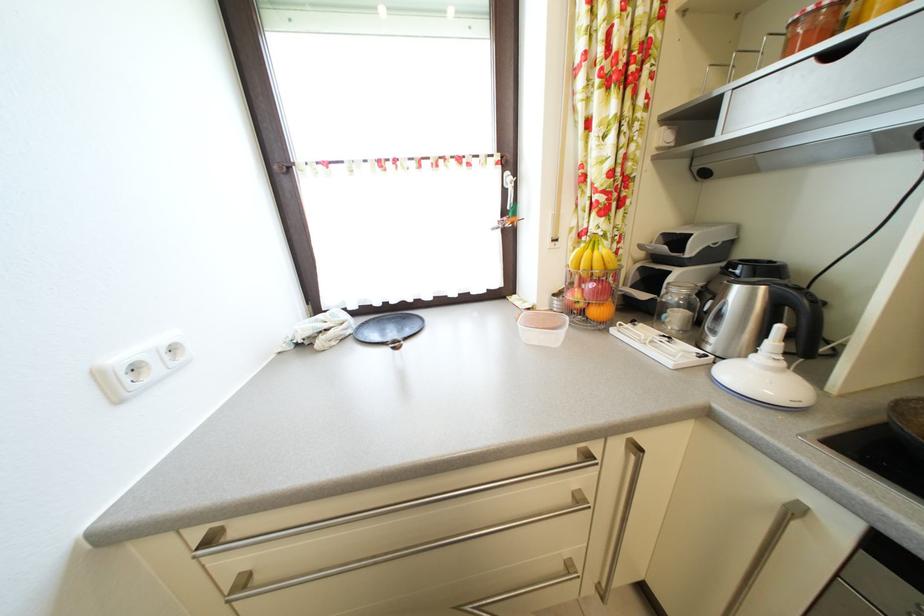
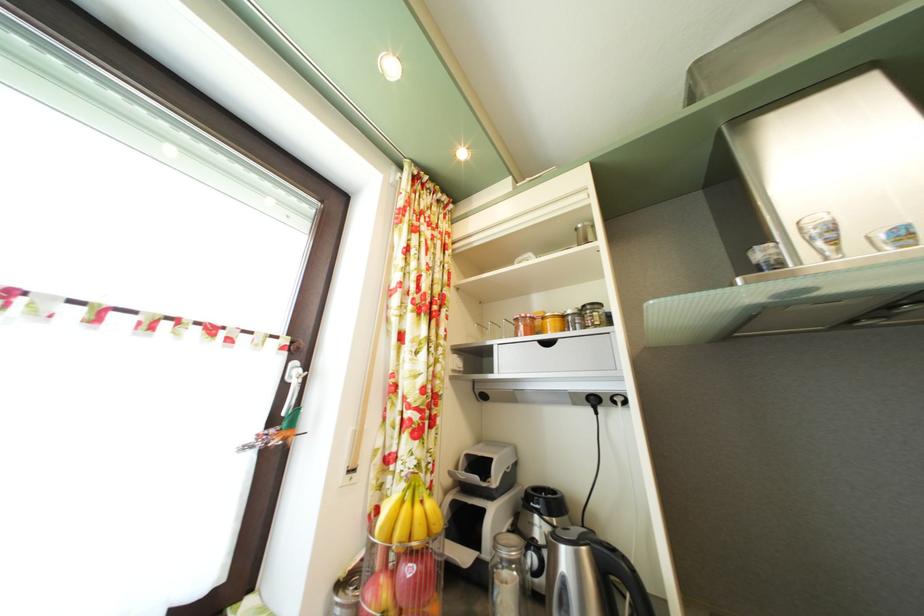
Locate, in the second image, the point that corresponds to pixel 771 296 in the first image.

(592, 556)